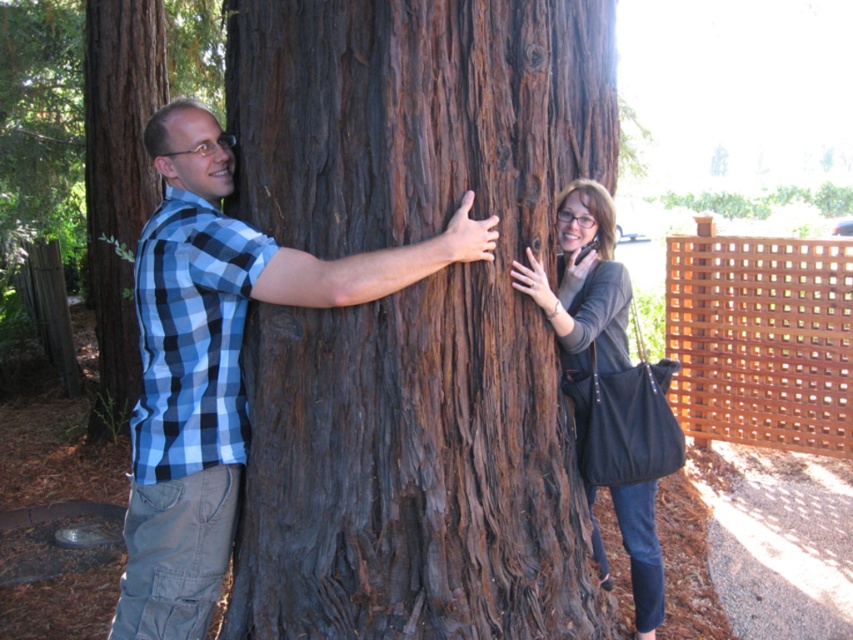
Does brown rough bark at center appear on the left side of blue plaid shirt at left?

No, brown rough bark at center is not to the left of blue plaid shirt at left.

Between brown rough bark at center and blue plaid shirt at left, which one appears on the right side from the viewer's perspective?

brown rough bark at center

Between point (469, 288) and point (222, 536), which one is positioned in front?

Point (469, 288) is in front.

Image resolution: width=853 pixels, height=640 pixels. What are the coordinates of `brown rough bark at center` in the screenshot? It's located at pos(412,316).

Does brown rough bark at center have a larger size compared to brown rough bark at left?

Correct, brown rough bark at center is larger in size than brown rough bark at left.

Does brown rough bark at center have a greater height compared to brown rough bark at left?

In fact, brown rough bark at center may be shorter than brown rough bark at left.

Where is `brown rough bark at center`? Image resolution: width=853 pixels, height=640 pixels. brown rough bark at center is located at coordinates (412, 316).

Can you confirm if blue plaid shirt at left is positioned below brown rough bark at left?

Correct, blue plaid shirt at left is located below brown rough bark at left.

Identify the location of blue plaid shirt at left. (218, 362).

Does point (125, 600) come behind point (138, 216)?

That is False.

Locate an element on the screen. blue plaid shirt at left is located at coordinates (218, 362).